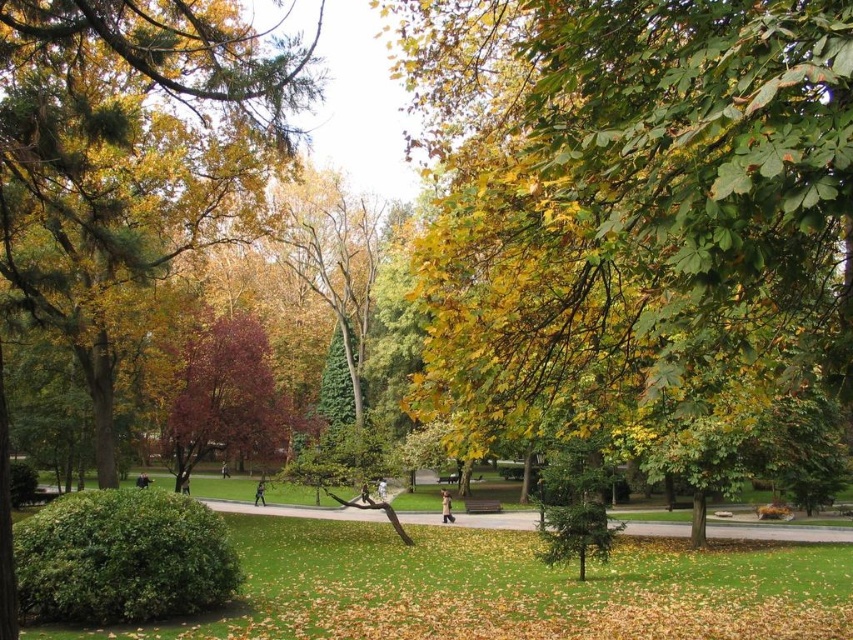
Which is behind, point (206, 140) or point (236, 321)?

Point (236, 321)

Is green glossy tree at upper left to the left of purple glossy tree at center from the viewer's perspective?

No, green glossy tree at upper left is not to the left of purple glossy tree at center.

At what (x,y) coordinates should I click in order to perform the action: click on green glossy tree at upper left. Please return your answer as a coordinate pair (x, y). Looking at the image, I should click on (132, 154).

Which is below, green leafy tree at center or purple glossy tree at center?

purple glossy tree at center is lower down.

Between point (595, 33) and point (207, 310), which one is positioned behind?

The point (207, 310) is more distant.

Between point (621, 129) and point (238, 342), which one is positioned in front?

Positioned in front is point (621, 129).

What are the coordinates of `green leafy tree at center` in the screenshot? It's located at (631, 211).

How much distance is there between green leafy tree at center and green glossy tree at upper left?

green leafy tree at center and green glossy tree at upper left are 8.49 meters apart.

Between point (732, 58) and point (241, 136), which one is positioned behind?

Point (241, 136)

You are a GUI agent. You are given a task and a screenshot of the screen. Output one action in this format:
    pyautogui.click(x=<x>, y=<y>)
    Task: Click on the green leafy tree at center
    The image size is (853, 640).
    Given the screenshot: What is the action you would take?
    pyautogui.click(x=631, y=211)